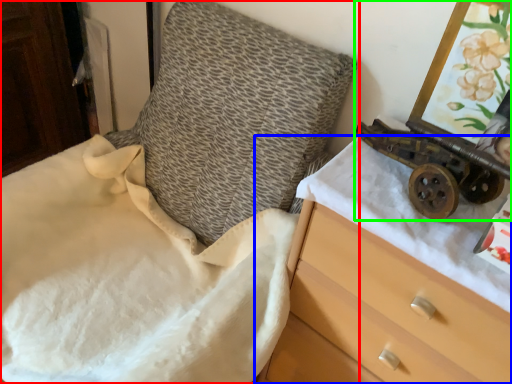
Question: Which object is the farthest from furniture (highlighted by a red box)? Choose among these: chest of drawers (highlighted by a blue box) or toy (highlighted by a green box).

Choices:
 (A) chest of drawers
 (B) toy

Answer: (B)